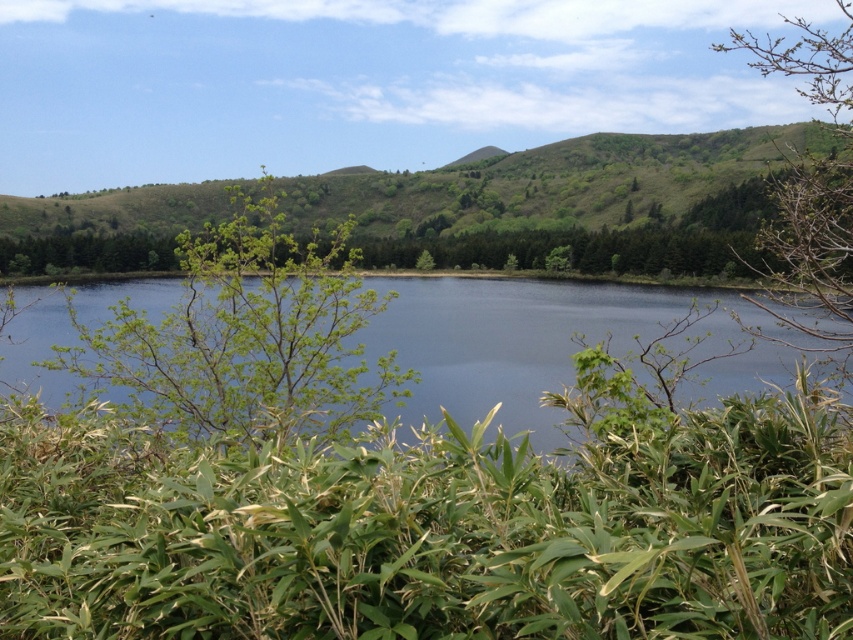
Question: Where is green leafy tree at center located in relation to green leafy tree at upper right in the image?

Choices:
 (A) right
 (B) left

Answer: (B)

Question: Among these points, which one is farthest from the camera?

Choices:
 (A) (323, 268)
 (B) (540, 390)

Answer: (B)

Question: Can you confirm if green leafy tree at center is positioned to the left of green leafy tree at upper right?

Choices:
 (A) no
 (B) yes

Answer: (B)

Question: Estimate the real-world distances between objects in this image. Which object is farther from the green leafy tree at center?

Choices:
 (A) green leafy tree at upper right
 (B) transparent blue water at center

Answer: (A)

Question: Which of the following is the closest to the observer?

Choices:
 (A) transparent blue water at center
 (B) green leafy tree at upper right

Answer: (A)

Question: Does transparent blue water at center come in front of green leafy tree at upper right?

Choices:
 (A) yes
 (B) no

Answer: (A)